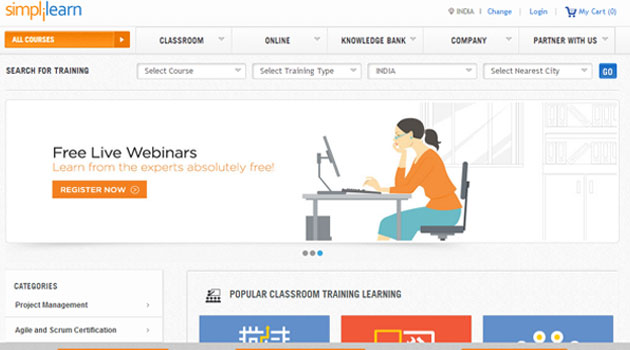
You are a GUI agent. You are given a task and a screenshot of the screen. Output one action in this format:
    pyautogui.click(x=<x>, y=<y>)
    Task: Click on the computer chair
    The width and height of the screenshot is (630, 350).
    Given the screenshot: What is the action you would take?
    pyautogui.click(x=462, y=181)